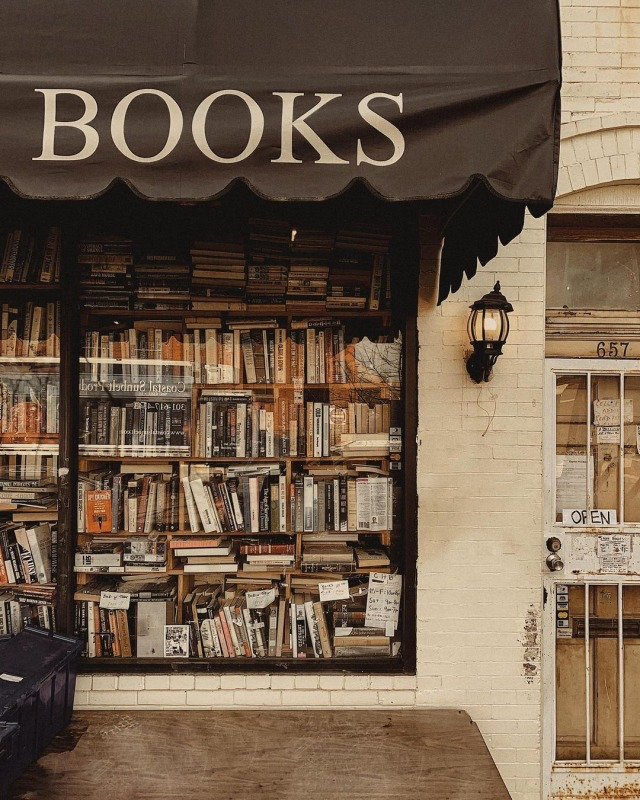
I want to click on door knob, so click(x=557, y=565).